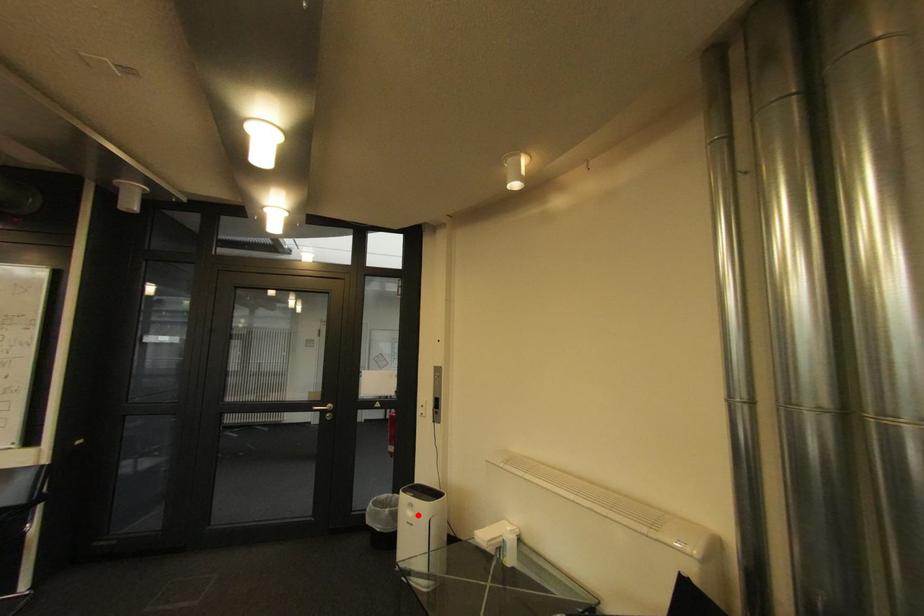
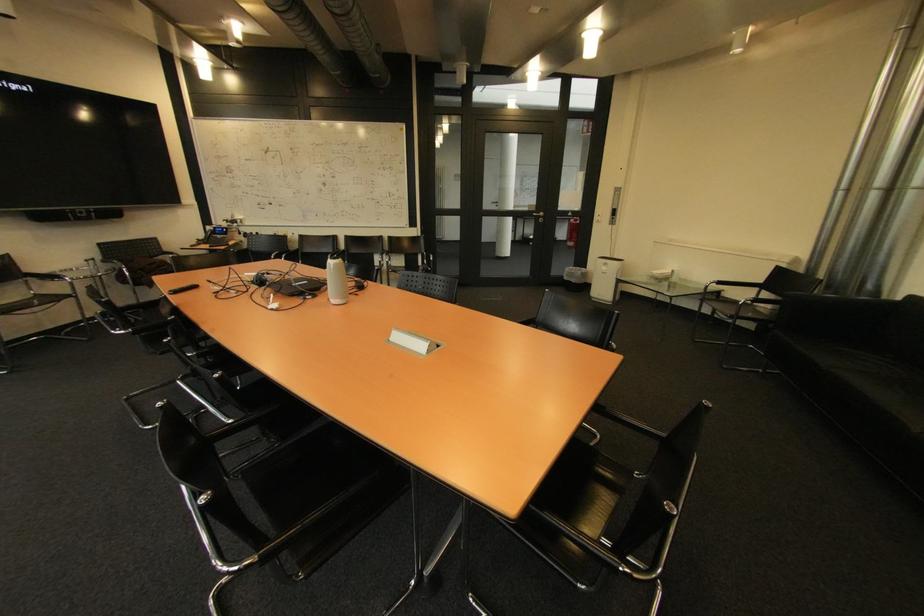
Question: A red point is marked in image1. In image2, is the corresponding 3D point closer to the camera or farther? Reply with the corresponding letter.

Choices:
 (A) The corresponding 3D point is closer.
 (B) The corresponding 3D point is farther.

Answer: (A)